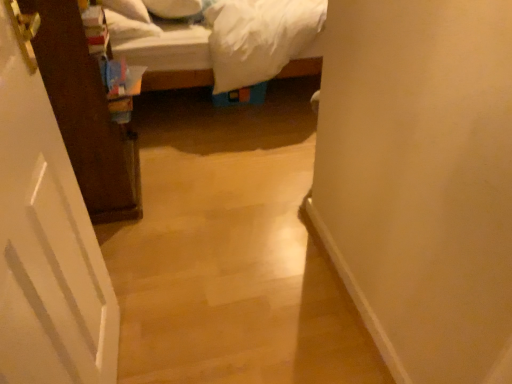
Question: Considering the positions of point (108, 6) and point (29, 129), is point (108, 6) closer or farther from the camera than point (29, 129)?

Choices:
 (A) closer
 (B) farther

Answer: (B)

Question: Considering the positions of white soft pillow at upper left, the 1th pillow positioned from the left, and white matte door at left in the image, is white soft pillow at upper left, the 1th pillow positioned from the left, bigger or smaller than white matte door at left?

Choices:
 (A) small
 (B) big

Answer: (A)

Question: Estimate the real-world distances between objects in this image. Which object is farther from the white soft pillow at upper center, which appears as the first pillow when viewed from the right?

Choices:
 (A) white matte door at left
 (B) white soft pillow at upper left, which is the second pillow from right to left

Answer: (A)

Question: Which object is positioned closest to the white matte door at left?

Choices:
 (A) white soft pillow at upper center, which appears as the first pillow when viewed from the right
 (B) white soft pillow at upper left, the 1th pillow positioned from the left

Answer: (B)